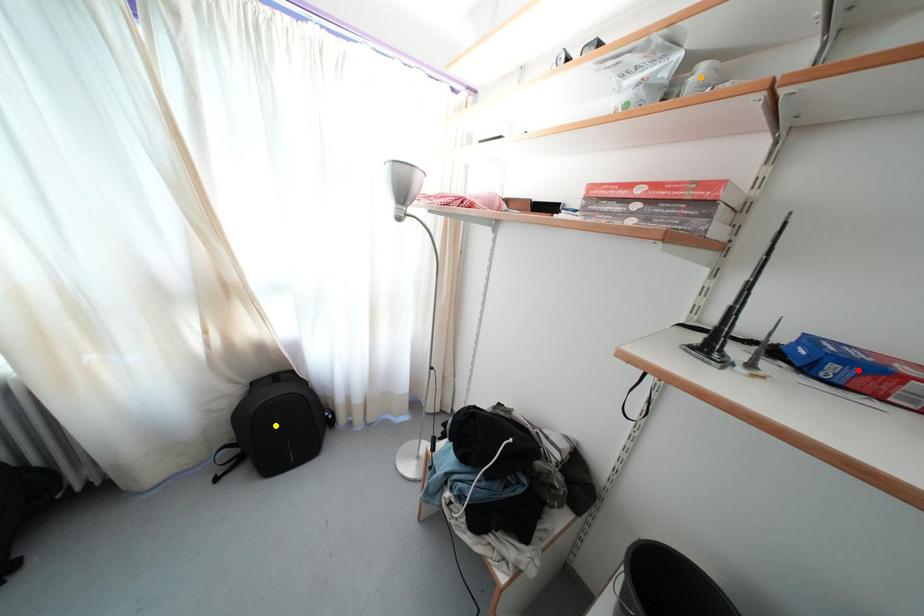
Order these from farthest to nearest:
yellow point | red point | orange point

yellow point, orange point, red point